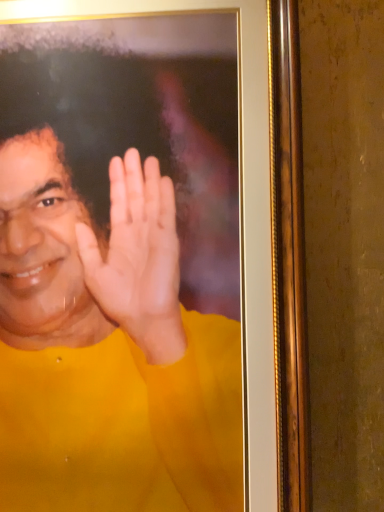
Locate an element on the screen. This screenshot has height=512, width=384. yellow matte shirt at center is located at coordinates (107, 348).

What do you see at coordinates (107, 348) in the screenshot? Image resolution: width=384 pixels, height=512 pixels. I see `yellow matte shirt at center` at bounding box center [107, 348].

Identify the location of yellow matte shirt at center. The image size is (384, 512). (107, 348).